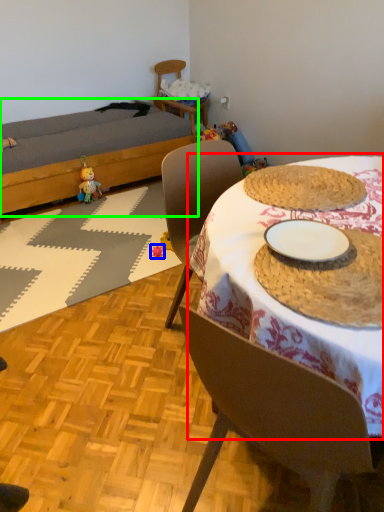
Question: Based on their relative distances, which object is farther from table (highlighted by a red box)? Choose from toy (highlighted by a blue box) and bed (highlighted by a green box).

Choices:
 (A) toy
 (B) bed

Answer: (B)